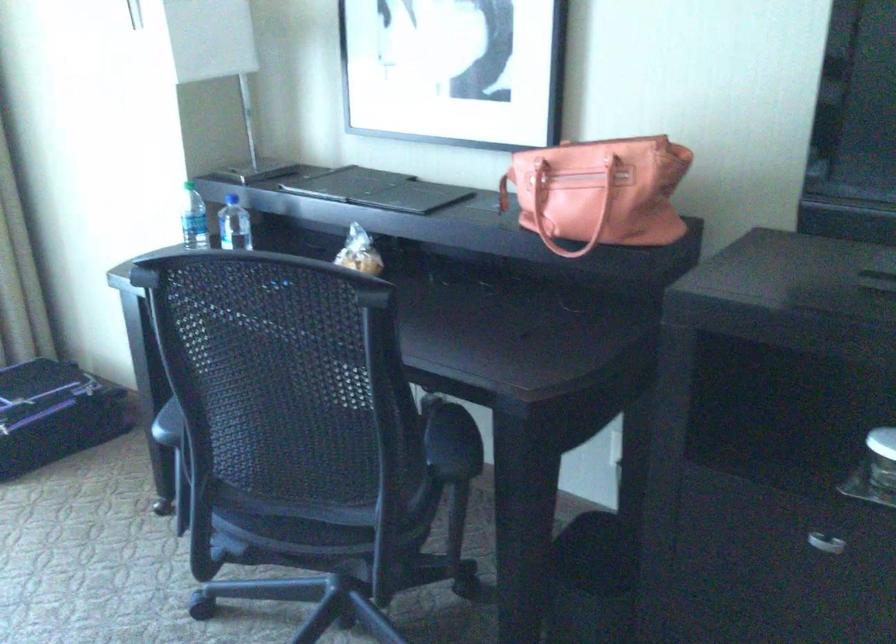
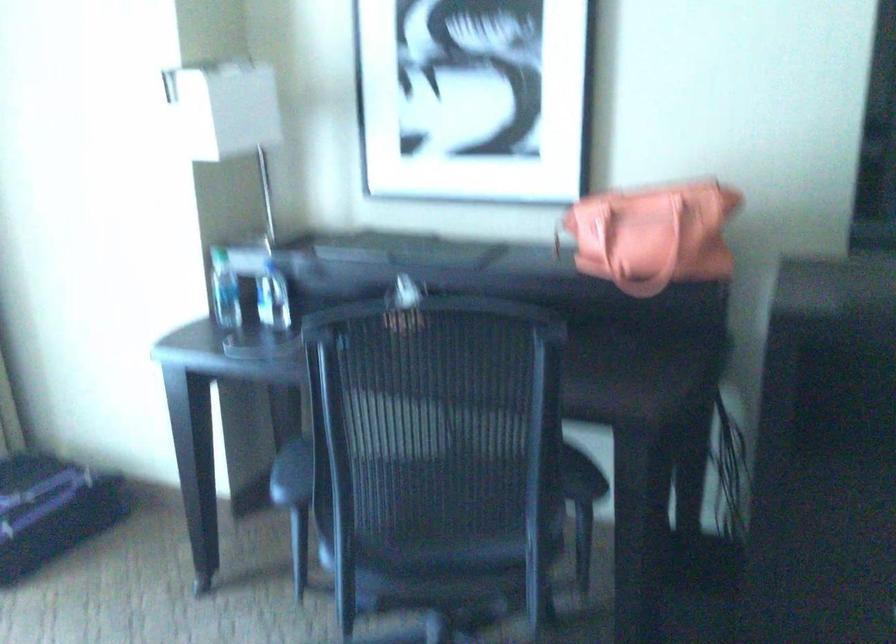
Find the pixel in the second image that matches [565,202] in the first image.

(633, 238)